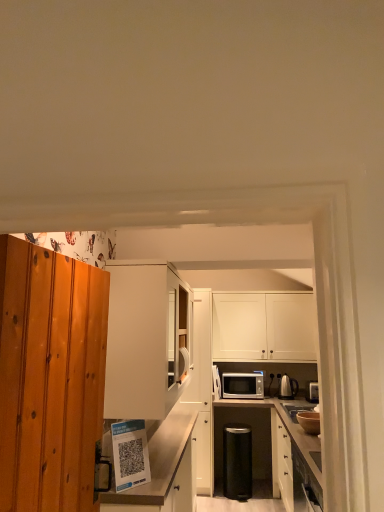
Question: Is silver metallic microwave at center not near satin silver kettle at right, which is the third appliance from left to right?

Choices:
 (A) no
 (B) yes

Answer: (A)

Question: From the image's perspective, is silver metallic microwave at center below satin silver kettle at right, arranged as the first appliance when viewed from the right?

Choices:
 (A) no
 (B) yes

Answer: (B)

Question: Can you confirm if silver metallic microwave at center is smaller than satin silver kettle at right, the 2th appliance when ordered from bottom to top?

Choices:
 (A) yes
 (B) no

Answer: (B)

Question: Is silver metallic microwave at center turned away from satin silver kettle at right, which is the first appliance from back to front?

Choices:
 (A) yes
 (B) no

Answer: (B)

Question: Is silver metallic microwave at center thinner than satin silver kettle at right, the 2th appliance when ordered from bottom to top?

Choices:
 (A) no
 (B) yes

Answer: (A)

Question: From the image's perspective, is silver metallic microwave at center on top of satin silver kettle at right, which is the first appliance from back to front?

Choices:
 (A) yes
 (B) no

Answer: (B)

Question: Considering the relative sizes of white matte cabinet at center, placed as the first cabinetry when sorted from left to right, and white matte cabinet at center, marked as the 3th cabinetry in a left-to-right arrangement, in the image provided, is white matte cabinet at center, placed as the first cabinetry when sorted from left to right, bigger than white matte cabinet at center, marked as the 3th cabinetry in a left-to-right arrangement,?

Choices:
 (A) no
 (B) yes

Answer: (B)

Question: From a real-world perspective, is white matte cabinet at center, which is the 4th cabinetry in right-to-left order, on top of white matte cabinet at center, marked as the 3th cabinetry in a left-to-right arrangement?

Choices:
 (A) yes
 (B) no

Answer: (A)

Question: Is white matte cabinet at center, which is the 4th cabinetry in right-to-left order, in front of white matte cabinet at center, marked as the 3th cabinetry in a left-to-right arrangement?

Choices:
 (A) yes
 (B) no

Answer: (A)

Question: Does white matte cabinet at center, which is the 4th cabinetry in right-to-left order, have a greater height compared to white matte cabinet at center, marked as the 3th cabinetry in a left-to-right arrangement?

Choices:
 (A) yes
 (B) no

Answer: (B)

Question: Is white matte cabinet at center, which is the 4th cabinetry in right-to-left order, behind white matte cabinet at center, marked as the 3th cabinetry in a left-to-right arrangement?

Choices:
 (A) no
 (B) yes

Answer: (A)

Question: Can you confirm if white matte cabinet at center, placed as the first cabinetry when sorted from left to right, is smaller than white matte cabinet at center, marked as the 3th cabinetry in a left-to-right arrangement?

Choices:
 (A) yes
 (B) no

Answer: (B)

Question: Is white matte cabinet at center, marked as the 3th cabinetry in a left-to-right arrangement, further to camera compared to matte white shelf at lower center, which is the third cabinetry from right to left?

Choices:
 (A) no
 (B) yes

Answer: (B)